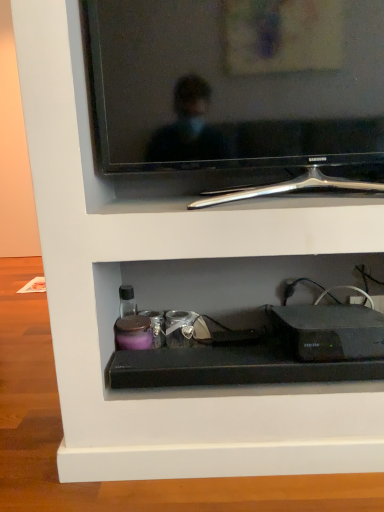
The image size is (384, 512). In order to click on free space below black glossy tv at upper center (from a real-world perspective) in this screenshot , I will do `click(253, 200)`.